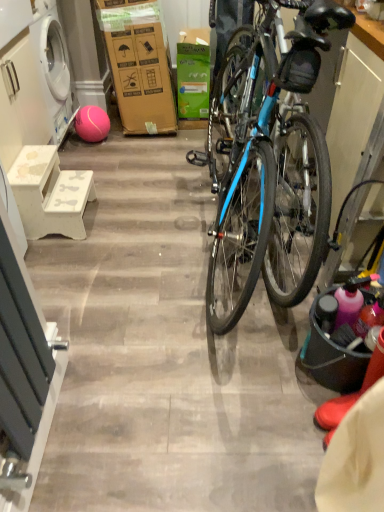
Locate an element on the screen. matte black bucket at right is located at coordinates (331, 357).

Image resolution: width=384 pixels, height=512 pixels. What do you see at coordinates (92, 124) in the screenshot?
I see `pink rubber ball at lower left` at bounding box center [92, 124].

Find the location of a particular element. The width and height of the screenshot is (384, 512). white wood cabinet at left is located at coordinates (20, 84).

Looking at this image, is green cardboard box at center situated inside white wood cabinet at left or outside?

The correct answer is: outside.

From a real-world perspective, which is physically above, green cardboard box at center or white wood cabinet at left?

white wood cabinet at left.

Can you confirm if green cardboard box at center is bigger than white wood cabinet at left?

No, green cardboard box at center is not bigger than white wood cabinet at left.

Find the location of a particular element. cabinetry that appears below the green cardboard box at center (from the image's perspective) is located at coordinates (20, 84).

Considering the positions of point (52, 197) and point (345, 373), is point (52, 197) closer or farther from the camera than point (345, 373)?

Point (52, 197).

Is white matte stool at left bigger or smaller than matte black bucket at right?

Considering their sizes, white matte stool at left takes up more space than matte black bucket at right.

From a real-world perspective, is white matte stool at left physically below matte black bucket at right?

Yes, from a real-world perspective, white matte stool at left is beneath matte black bucket at right.

Could you tell me if white wood cabinet at left is facing white matte stool at left?

No.

Does point (7, 135) appear closer or farther from the camera than point (50, 191)?

Point (7, 135) is closer to the camera than point (50, 191).

Can you tell me how much white wood cabinet at left and white matte stool at left differ in facing direction?

1.74 degrees.

Are white wood cabinet at left and white matte stool at left beside each other?

white wood cabinet at left and white matte stool at left are not in contact.

Which point is more distant from viewer, (83, 121) or (181, 101)?

The point (181, 101) is behind.

Is pink rubber ball at lower left positioned far away from green cardboard box at center?

No, pink rubber ball at lower left is not far away from green cardboard box at center.

Image resolution: width=384 pixels, height=512 pixels. Identify the location of box that is above the pink rubber ball at lower left (from the image's perspective). (193, 74).

Between pink rubber ball at lower left and green cardboard box at center, which one is positioned behind?

green cardboard box at center is more distant.

Is green cardboard box at center bigger than matte black bucket at right?

Correct, green cardboard box at center is larger in size than matte black bucket at right.

Is matte black bucket at right at the back of green cardboard box at center?

No, green cardboard box at center is not facing the opposite direction of matte black bucket at right.

How different are the orientations of green cardboard box at center and matte black bucket at right in degrees?

86.5 degrees separate the facing orientations of green cardboard box at center and matte black bucket at right.

From a real-world perspective, is white matte stool at left physically located above or below green cardboard box at center?

From a real-world perspective, white matte stool at left is physically below green cardboard box at center.

Considering the positions of points (81, 206) and (182, 96), is point (81, 206) farther from camera compared to point (182, 96)?

No, (81, 206) is in front of (182, 96).

Which object is more forward, white matte stool at left or green cardboard box at center?

white matte stool at left is closer to the camera.

In the scene shown: Is white matte stool at left not close to green cardboard box at center?

white matte stool at left is positioned a significant distance from green cardboard box at center.

Which of these two, matte black bucket at right or white wood cabinet at left, is smaller?

With smaller size is matte black bucket at right.

From the image's perspective, is matte black bucket at right above white wood cabinet at left?

No, from the image's perspective, matte black bucket at right is not over white wood cabinet at left.

Would you say matte black bucket at right is to the left or to the right of white wood cabinet at left in the picture?

Clearly, matte black bucket at right is on the right of white wood cabinet at left in the image.

Is matte black bucket at right not inside white wood cabinet at left?

matte black bucket at right lies outside white wood cabinet at left's area.

Image resolution: width=384 pixels, height=512 pixels. What are the coordinates of `box on the right of white wood cabinet at left` in the screenshot? It's located at (193, 74).

Identify the location of bucket above the white matte stool at left (from a real-world perspective). The height and width of the screenshot is (512, 384). (331, 357).

Looking at the image, which one is located closer to green cardboard box at center, pink rubber ball at lower left or white matte stool at left?

pink rubber ball at lower left is positioned closer to the anchor green cardboard box at center.

From the image, which object appears to be farther from pink rubber ball at lower left, matte black bucket at right or green cardboard box at center?

Among the two, matte black bucket at right is located further to pink rubber ball at lower left.

Which object lies nearer to the anchor point pink rubber ball at lower left, green cardboard box at center or matte black bucket at right?

green cardboard box at center lies closer to pink rubber ball at lower left than the other object.

Consider the image. Which object lies further to the anchor point green cardboard box at center, matte black bucket at right or pink rubber ball at lower left?

matte black bucket at right lies further to green cardboard box at center than the other object.

When comparing their distances from white wood cabinet at left, does pink rubber ball at lower left or matte black bucket at right seem further?

matte black bucket at right is positioned further to the anchor white wood cabinet at left.

Which object lies nearer to the anchor point green cardboard box at center, white matte stool at left or matte black bucket at right?

Among the two, white matte stool at left is located nearer to green cardboard box at center.

Considering their positions, is white wood cabinet at left positioned further to white matte stool at left than matte black bucket at right?

The object further to white matte stool at left is matte black bucket at right.

Estimate the real-world distances between objects in this image. Which object is further from white wood cabinet at left, green cardboard box at center or matte black bucket at right?

matte black bucket at right is further to white wood cabinet at left.

What are the coordinates of `ball between white wood cabinet at left and matte black bucket at right` in the screenshot? It's located at (92, 124).

This screenshot has height=512, width=384. I want to click on stool between white wood cabinet at left and matte black bucket at right from left to right, so click(x=50, y=193).

Locate an element on the screen. stool located between matte black bucket at right and pink rubber ball at lower left in the depth direction is located at coordinates (50, 193).

The width and height of the screenshot is (384, 512). Find the location of `ball that lies between white wood cabinet at left and white matte stool at left from top to bottom`. ball that lies between white wood cabinet at left and white matte stool at left from top to bottom is located at coordinates (92, 124).